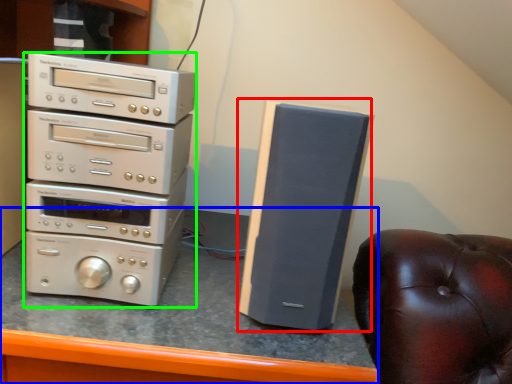
Question: Considering the real-world distances, which object is farthest from speaker (highlighted by a red box)? computer desk (highlighted by a blue box) or home appliance (highlighted by a green box)?

Choices:
 (A) computer desk
 (B) home appliance

Answer: (B)